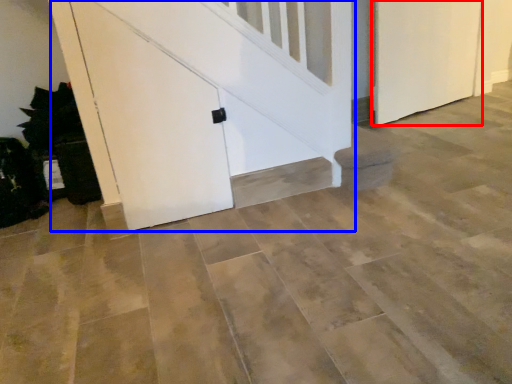
Question: Which of the following is the farthest to the observer, door (highlighted by a red box) or door (highlighted by a blue box)?

Choices:
 (A) door
 (B) door

Answer: (A)